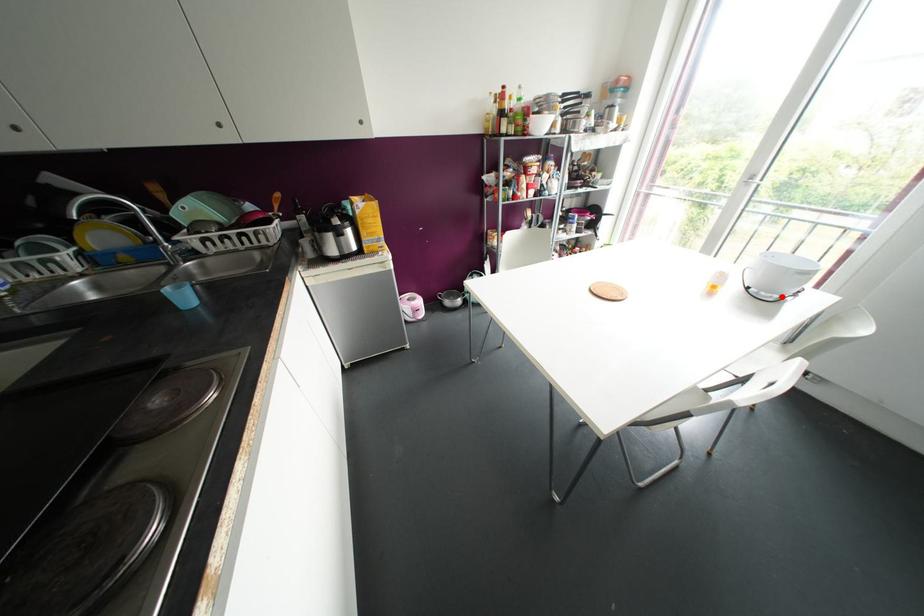
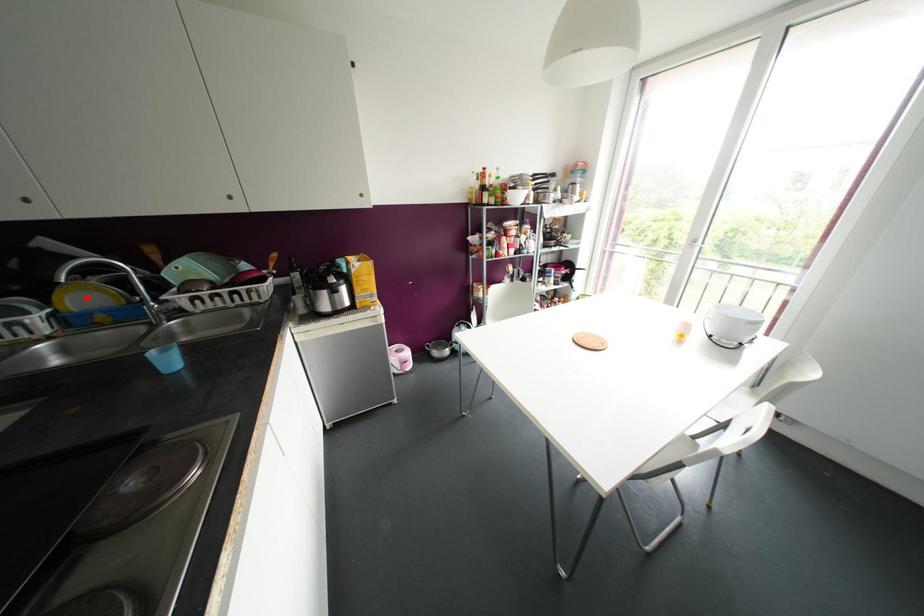
I am providing you with two images of the same scene from different viewpoints. A red point is marked on the first image and another point is marked on the second image. Is the red point in image1 aligned with the point shown in image2?

No